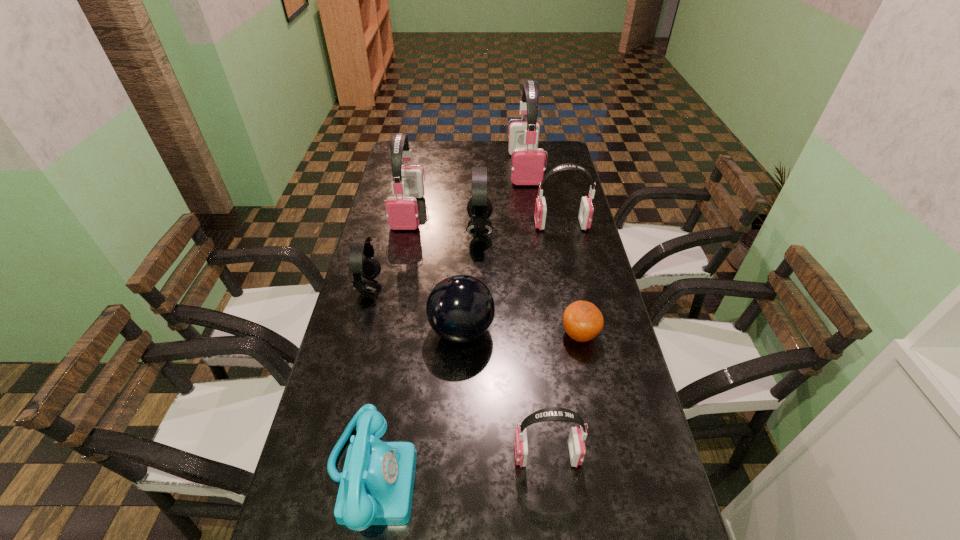
Identify the location of vacant space that satisfies the following two spatial constraints: 1. on the outer surface of the orange; 2. on the left side of the leftmost pink earphone. The width and height of the screenshot is (960, 540). (384, 335).

At what (x,y) coordinates should I click in order to perform the action: click on vacant region that satisfies the following two spatial constraints: 1. on the outer surface of the tallest earphone; 2. on the ear cups of the third earphone from left to right. Please return your answer as a coordinate pair (x, y). This screenshot has width=960, height=540. Looking at the image, I should click on (533, 230).